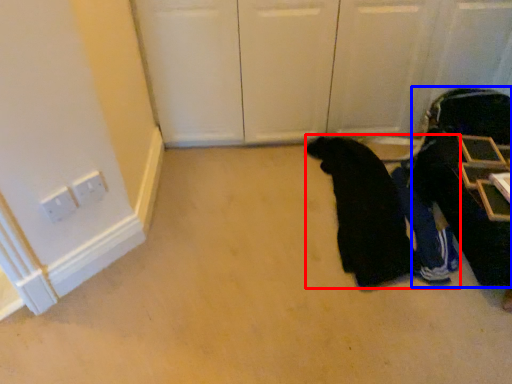
Question: Among these objects, which one is farthest to the camera, person (highlighted by a red box) or luggage (highlighted by a blue box)?

Choices:
 (A) person
 (B) luggage

Answer: (A)